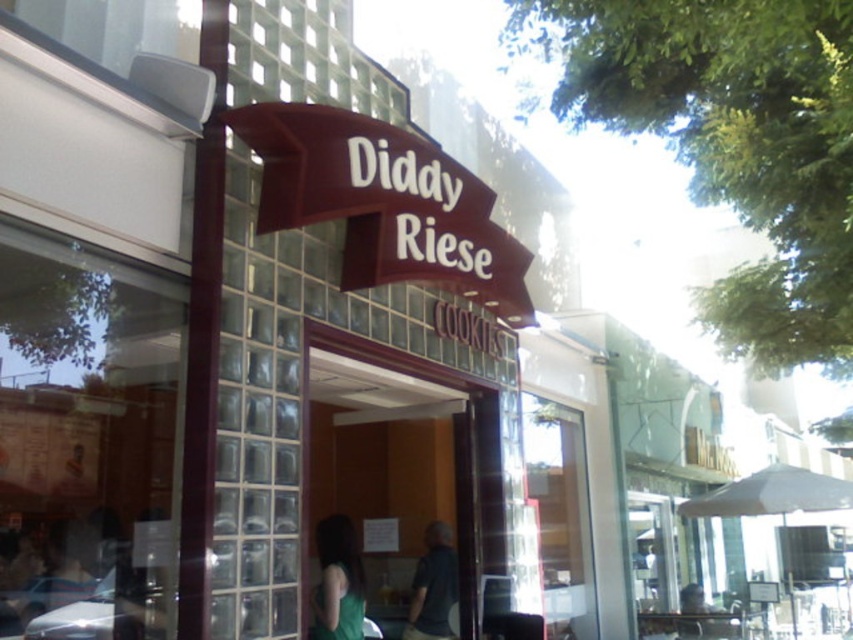
Question: Estimate the real-world distances between objects in this image. Which object is farther from the transparent glass door at left?

Choices:
 (A) green matte tank top at center
 (B) dark gray shirt at center
 (C) transparent glass door at center

Answer: (B)

Question: Which object is farther from the camera taking this photo?

Choices:
 (A) transparent glass door at center
 (B) transparent glass door at left
 (C) dark gray shirt at center

Answer: (C)

Question: Can you confirm if transparent glass door at center is smaller than dark gray shirt at center?

Choices:
 (A) yes
 (B) no

Answer: (B)

Question: Can you confirm if transparent glass door at left is positioned to the left of green matte tank top at center?

Choices:
 (A) yes
 (B) no

Answer: (A)

Question: Which object is the closest to the transparent glass door at left?

Choices:
 (A) dark gray shirt at center
 (B) transparent glass door at center

Answer: (B)

Question: Is transparent glass door at center smaller than green matte tank top at center?

Choices:
 (A) yes
 (B) no

Answer: (B)